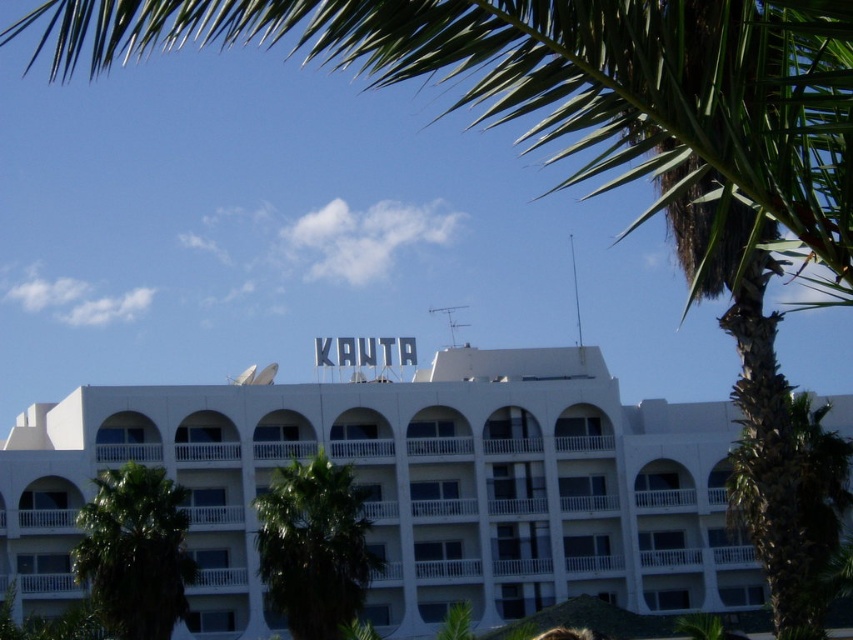
You are standing in front of the white matte building at center and want to walk to the green leafy palm tree at lower left. Which direction should you face to move towards it?

The white matte building at center is closer to you than the green leafy palm tree at lower left, so to move towards the palm tree, you should face away from the building and towards the lower left direction.